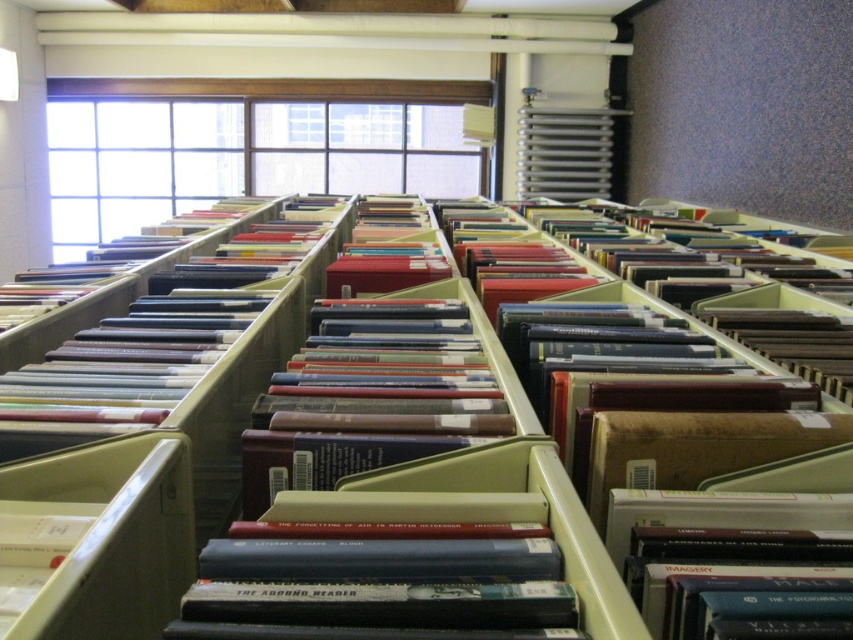
Which is more to the left, matte plastic bookshelf at center or brown matte folder at center?

brown matte folder at center

Between matte plastic bookshelf at center and brown matte folder at center, which one has more height?

matte plastic bookshelf at center

What do you see at coordinates (407, 490) in the screenshot? I see `matte plastic bookshelf at center` at bounding box center [407, 490].

I want to click on matte plastic bookshelf at center, so click(x=407, y=490).